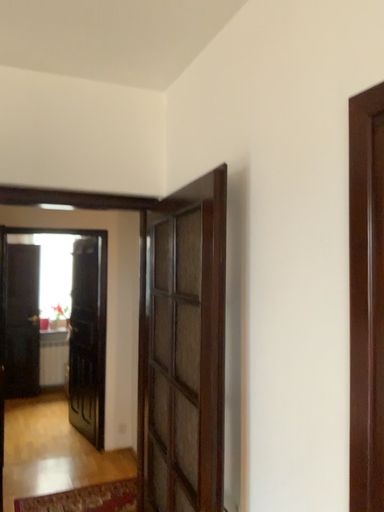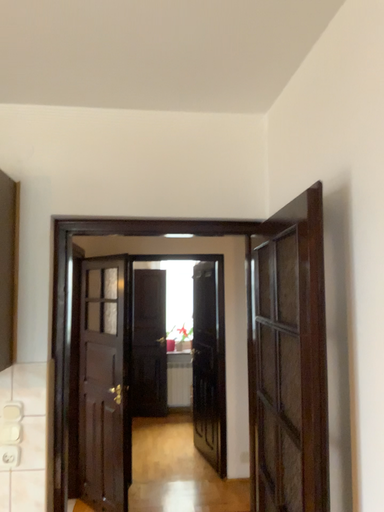
Question: How did the camera likely rotate when shooting the video?

Choices:
 (A) rotated left
 (B) rotated right

Answer: (A)